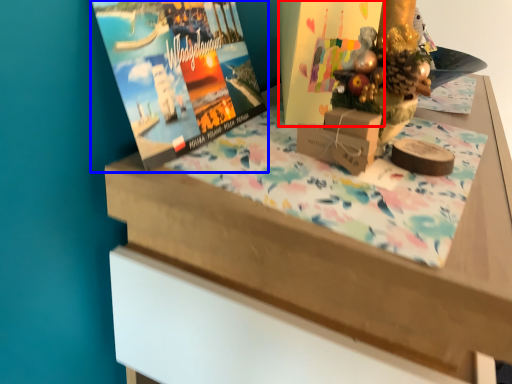
Question: Which point is further to the camera, book cover (highlighted by a red box) or magazine (highlighted by a blue box)?

Choices:
 (A) book cover
 (B) magazine

Answer: (A)